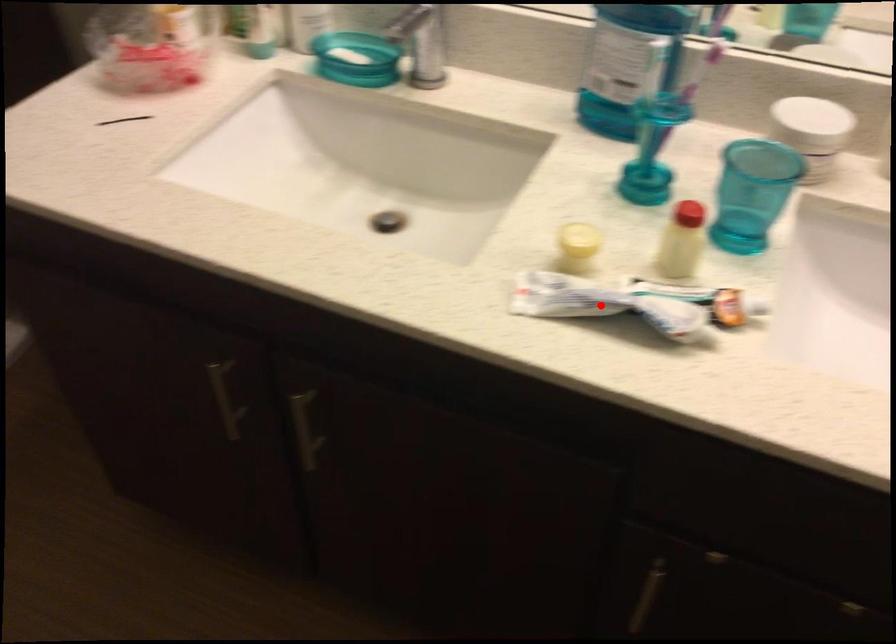
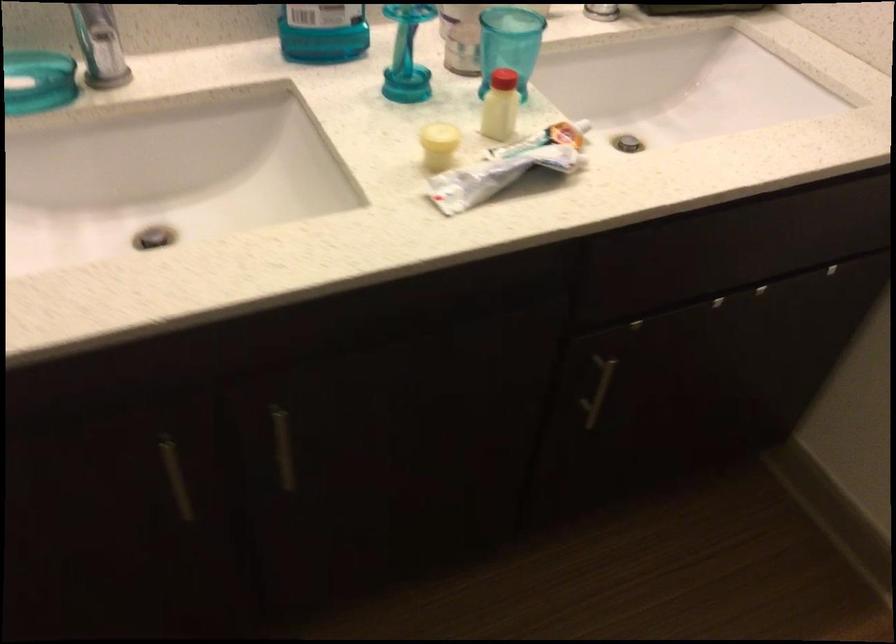
Locate, in the second image, the point that corresponds to the highlighted location in the first image.

(495, 176)